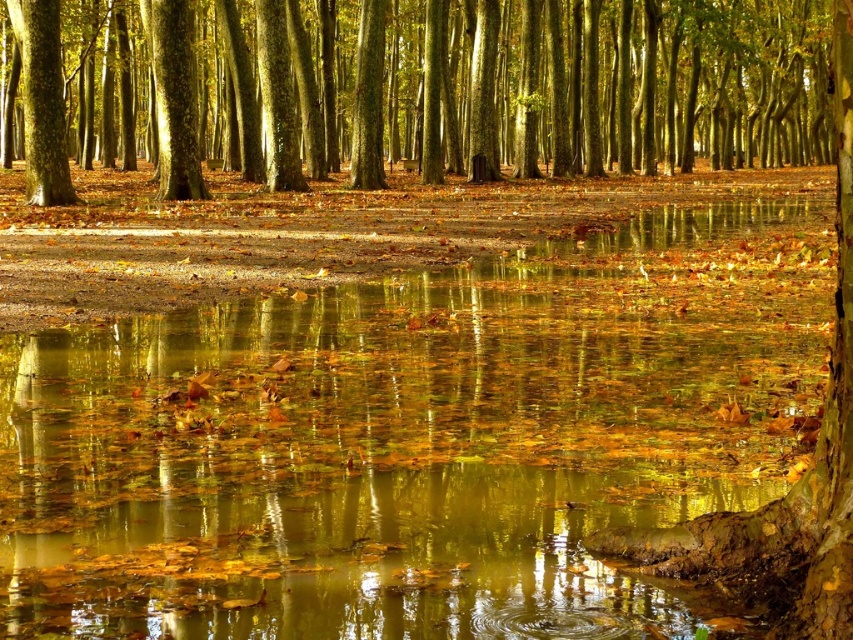
Between point (648, 593) and point (154, 38), which one is positioned in front?

Point (648, 593) is in front.

Can you confirm if translucent golden leaves at center is smaller than smooth brown tree trunk at upper left?

Yes.

Between point (491, 582) and point (164, 97), which one is positioned behind?

The point (164, 97) is more distant.

Locate an element on the screen. The height and width of the screenshot is (640, 853). translucent golden leaves at center is located at coordinates (415, 440).

Can you confirm if translucent golden leaves at center is thinner than smooth bark tree at center?

Indeed, translucent golden leaves at center has a lesser width compared to smooth bark tree at center.

Does translucent golden leaves at center have a greater height compared to smooth bark tree at center?

In fact, translucent golden leaves at center may be shorter than smooth bark tree at center.

Is point (529, 451) farther from viewer compared to point (810, 161)?

No, it is not.

Locate an element on the screen. The height and width of the screenshot is (640, 853). translucent golden leaves at center is located at coordinates (415, 440).

Is smooth bark tree at center closer to the viewer compared to smooth brown tree trunk at upper left?

Yes.

Does point (605, 64) come closer to viewer compared to point (160, 128)?

No, (605, 64) is behind (160, 128).

You are a GUI agent. You are given a task and a screenshot of the screen. Output one action in this format:
    pyautogui.click(x=<x>, y=<y>)
    Task: Click on the smooth bark tree at center
    This screenshot has height=640, width=853.
    Given the screenshot: What is the action you would take?
    pyautogui.click(x=427, y=88)